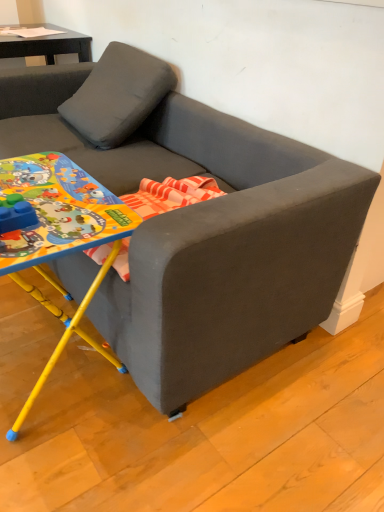
Question: From a real-world perspective, is matte gray couch at center positioned above or below yellow plastic table at lower left?

Choices:
 (A) below
 (B) above

Answer: (B)

Question: Looking at their shapes, would you say matte gray couch at center is wider or thinner than yellow plastic table at lower left?

Choices:
 (A) thin
 (B) wide

Answer: (B)

Question: Is matte gray couch at center situated inside yellow plastic table at lower left or outside?

Choices:
 (A) inside
 (B) outside

Answer: (B)

Question: Is yellow plastic table at lower left wider or thinner than matte gray couch at center?

Choices:
 (A) thin
 (B) wide

Answer: (A)

Question: From the image's perspective, relative to matte gray couch at center, is yellow plastic table at lower left above or below?

Choices:
 (A) below
 (B) above

Answer: (A)

Question: In the image, is yellow plastic table at lower left positioned in front of or behind matte gray couch at center?

Choices:
 (A) front
 (B) behind

Answer: (B)

Question: From a real-world perspective, relative to matte gray couch at center, is yellow plastic table at lower left vertically above or below?

Choices:
 (A) below
 (B) above

Answer: (A)